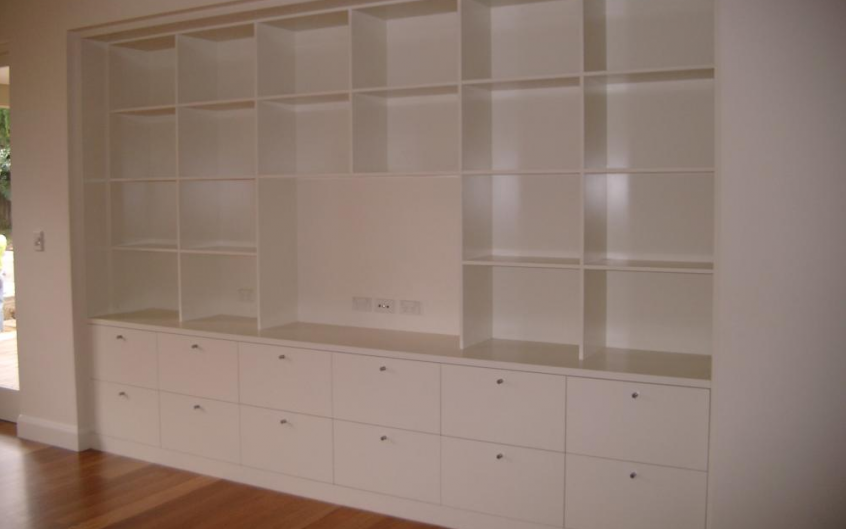
Find the location of a particular element. This screenshot has height=529, width=846. white walls is located at coordinates (41, 99), (786, 204).